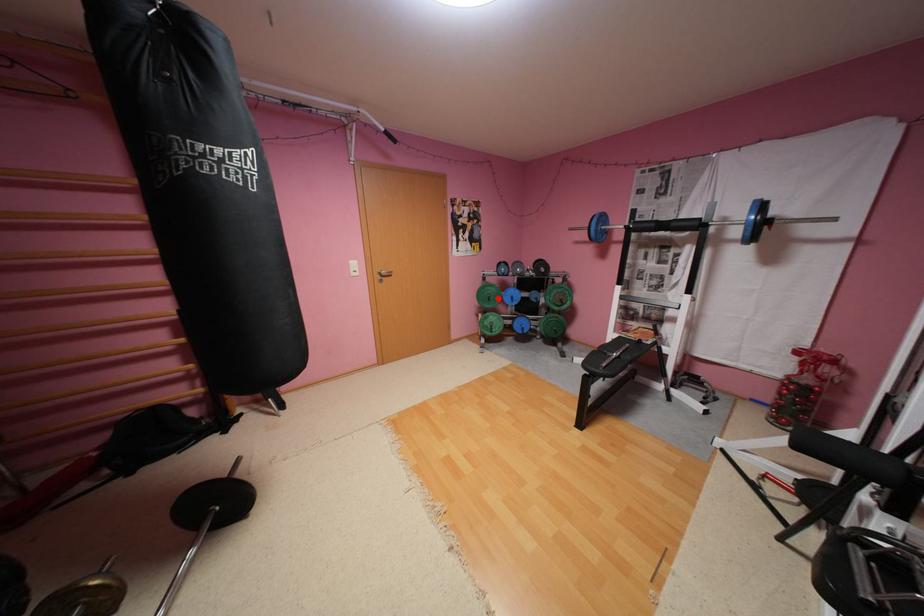
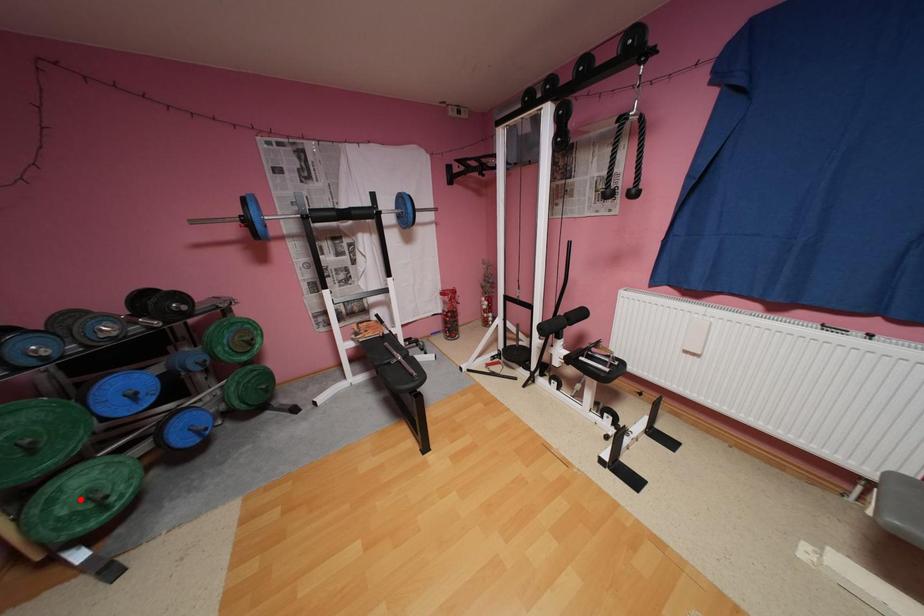
I am providing you with two images of the same scene from different viewpoints. A red point is marked on the first image and another point is marked on the second image. Is the marked point in image1 the same physical position as the marked point in image2?

No